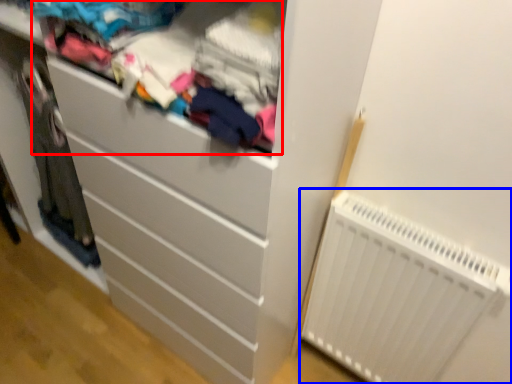
Question: Which of the following is the farthest to the observer, clothing (highlighted by a red box) or radiator (highlighted by a blue box)?

Choices:
 (A) clothing
 (B) radiator

Answer: (B)